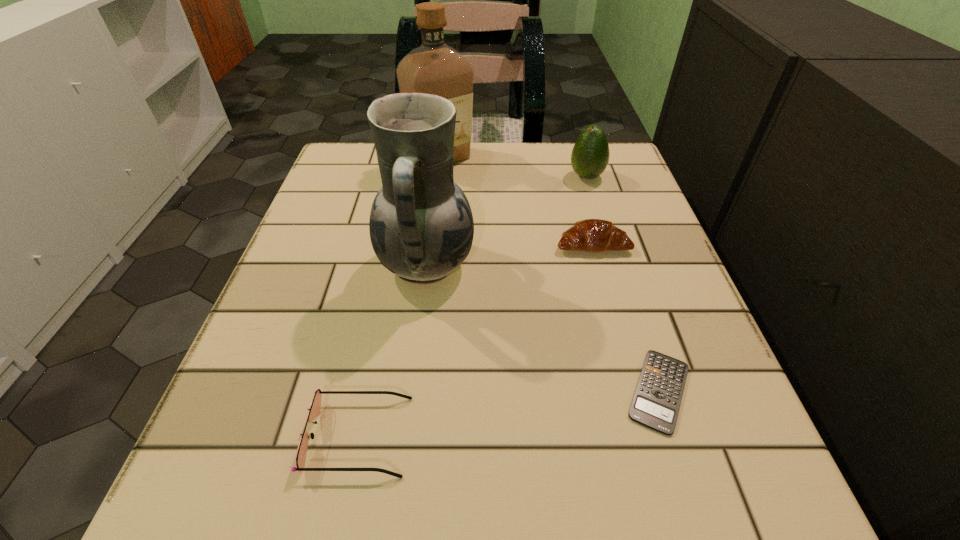
At what (x,y) coordinates should I click in order to perform the action: click on vacant space in between the calculator and the third shortest object. Please return your answer as a coordinate pair (x, y). This screenshot has height=540, width=960. Looking at the image, I should click on (626, 318).

Where is `free space that is in between the liquor and the avocado`? The height and width of the screenshot is (540, 960). free space that is in between the liquor and the avocado is located at coordinates (514, 167).

Image resolution: width=960 pixels, height=540 pixels. Find the location of `vacant area between the fifth tallest object and the crescent roll`. vacant area between the fifth tallest object and the crescent roll is located at coordinates (475, 340).

At what (x,y) coordinates should I click in order to perform the action: click on free space between the avocado and the fifth tallest object. Please return your answer as a coordinate pair (x, y). The image size is (960, 540). Looking at the image, I should click on (472, 306).

Locate an element on the screen. The width and height of the screenshot is (960, 540). unoccupied position between the crescent roll and the pitcher is located at coordinates (510, 255).

Where is `free spot between the crescent roll and the second shortest object`? This screenshot has width=960, height=540. free spot between the crescent roll and the second shortest object is located at coordinates (475, 340).

What are the coordinates of `unoccupied position between the third tallest object and the liquor` in the screenshot? It's located at (514, 167).

This screenshot has height=540, width=960. What are the coordinates of `object that is the fourth closest to the third tallest object` in the screenshot? It's located at (656, 402).

Image resolution: width=960 pixels, height=540 pixels. I want to click on object that is the closest one to the third shortest object, so click(421, 226).

At what (x,y) coordinates should I click in order to perform the action: click on free space that satisfies the following two spatial constraints: 1. on the front-facing side of the calculator; 2. on the right side of the pitcher. Please return your answer as a coordinate pair (x, y). The width and height of the screenshot is (960, 540). Looking at the image, I should click on (411, 391).